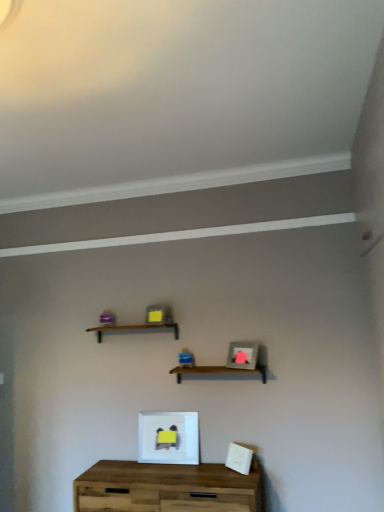
Question: Considering the positions of matte gray picture frame at center, which is counted as the second picture frame, starting from the left, and white matte picture frame at center, the 1th picture frame positioned from the left, in the image, is matte gray picture frame at center, which is counted as the second picture frame, starting from the left, bigger or smaller than white matte picture frame at center, the 1th picture frame positioned from the left,?

Choices:
 (A) small
 (B) big

Answer: (A)

Question: In the image, is matte gray picture frame at center, positioned as the first picture frame in right-to-left order, positioned in front of or behind white matte picture frame at center, the 2th picture frame from the top?

Choices:
 (A) front
 (B) behind

Answer: (A)

Question: Which of these objects is positioned farthest from the matte gray picture frame at center, acting as the second picture frame starting from the bottom?

Choices:
 (A) white matte picture frame at center, the 2th picture frame from the top
 (B) wooden shelf at center, acting as the first shelf starting from the top
 (C) wooden at center, which is counted as the first shelf, starting from the right
 (D) wooden table at center

Answer: (D)

Question: Which object is positioned farthest from the matte gray picture frame at center, acting as the second picture frame starting from the bottom?

Choices:
 (A) white matte picture frame at center, the 2th picture frame from the top
 (B) wooden at center, which is counted as the first shelf, starting from the right
 (C) wooden table at center
 (D) wooden shelf at center, marked as the second shelf in a bottom-to-top arrangement

Answer: (C)